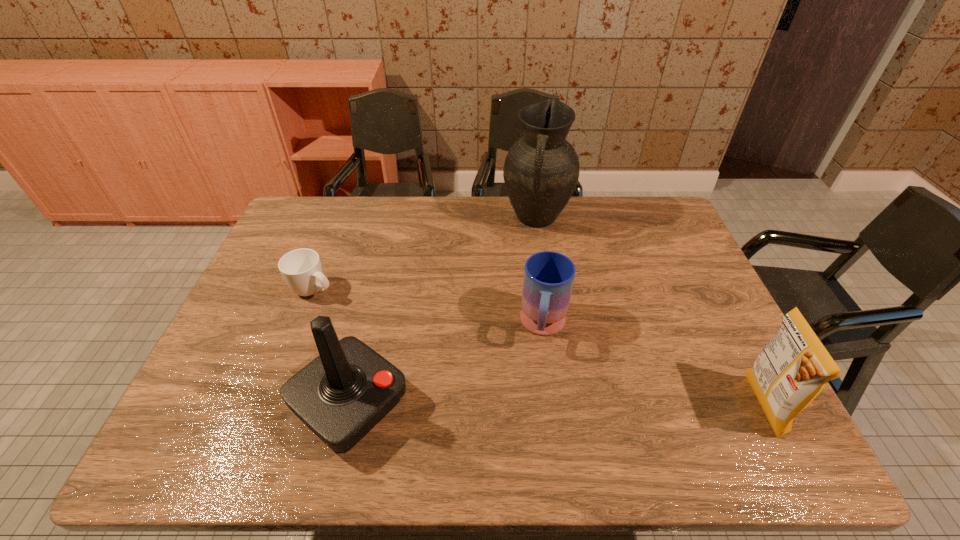
This screenshot has height=540, width=960. What are the coordinates of `vacant space on the desktop that is between the joystick and the crisp (potato chip) and is positioned on the side of the mug with the handle` in the screenshot? It's located at (532, 405).

This screenshot has height=540, width=960. I want to click on vacant space on the desktop that is between the joystick and the third shortest object and is positioned with the handle on the side of the shortest object, so click(527, 405).

The width and height of the screenshot is (960, 540). Find the location of `free space on the desktop that is between the joystick and the third tallest object and is positioned on the side of the tallest object with the handle`. free space on the desktop that is between the joystick and the third tallest object and is positioned on the side of the tallest object with the handle is located at coordinates (495, 405).